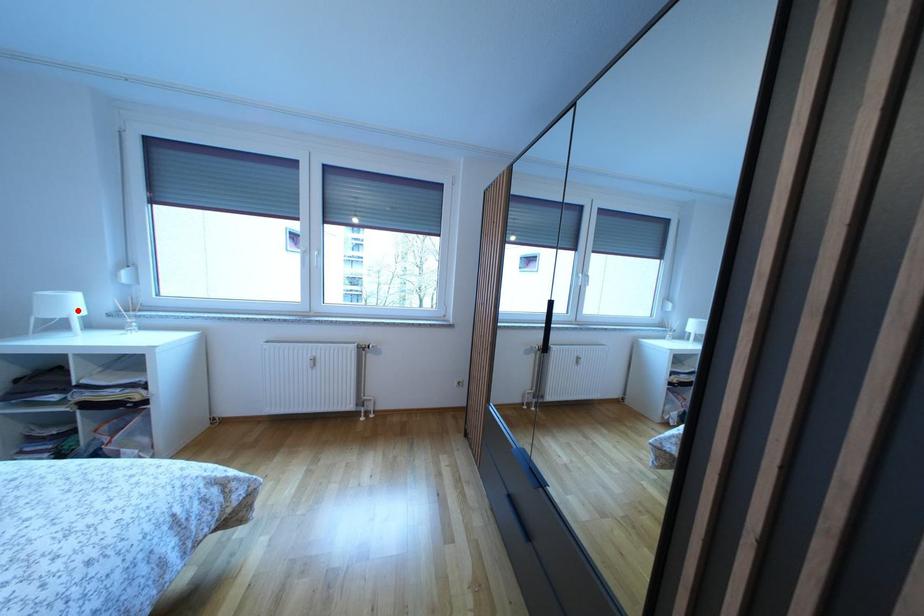
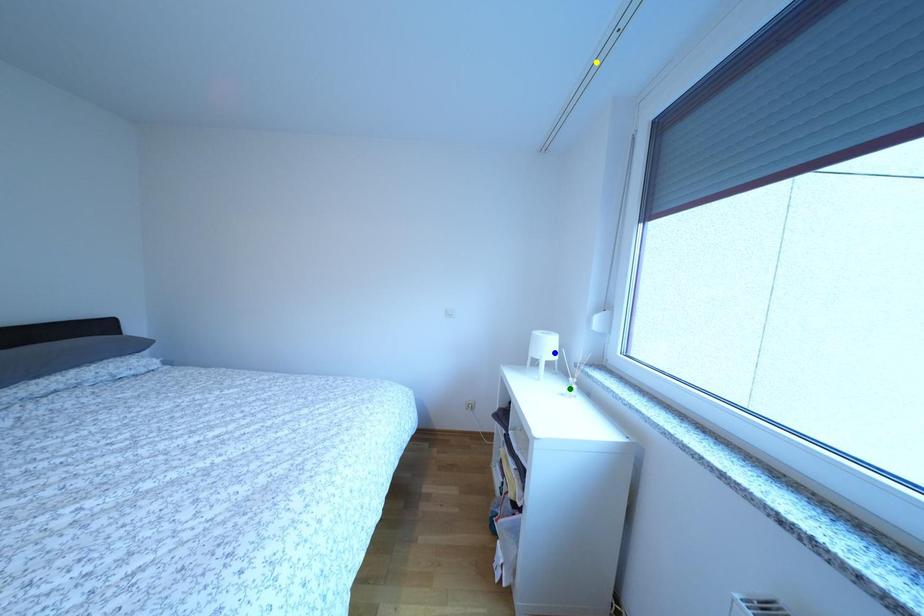
Question: I am providing you with two images of the same scene from different viewpoints. A red point is marked on the first image. You are given multiple points on the second image. In image 2, which mark is for the same physical point as the one in image 1?

Choices:
 (A) green point
 (B) yellow point
 (C) blue point

Answer: (C)